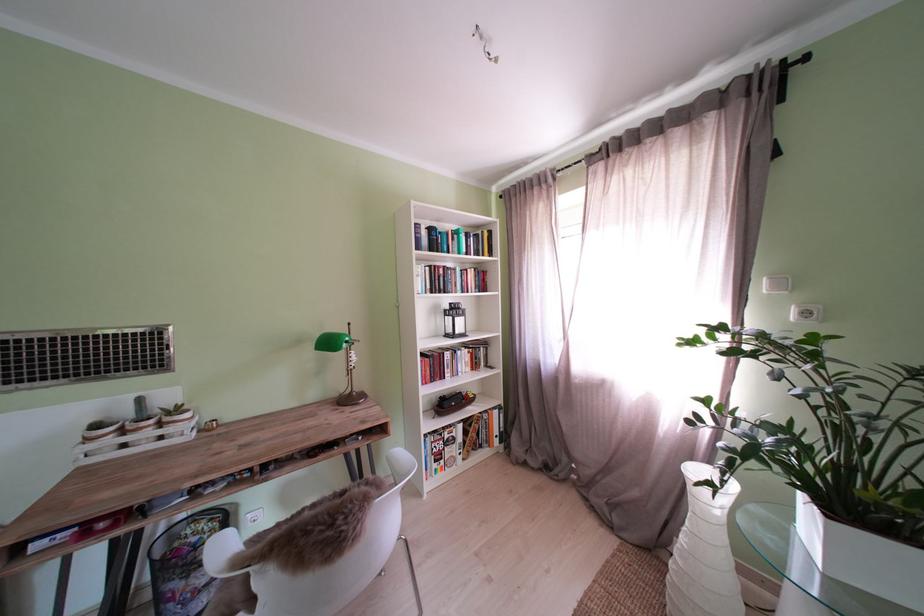
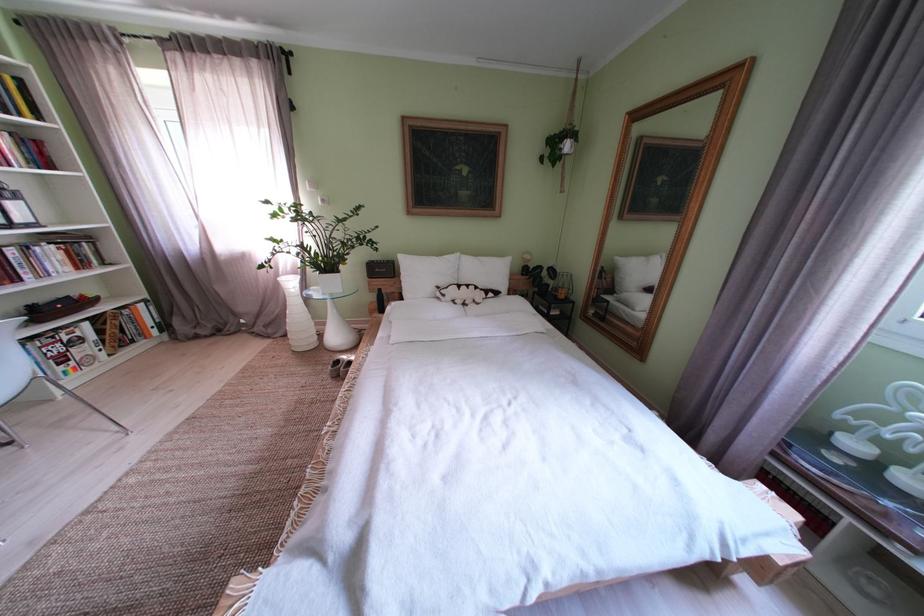
Where in the second image is the point corresponding to point (466, 445) from the first image?

(92, 344)